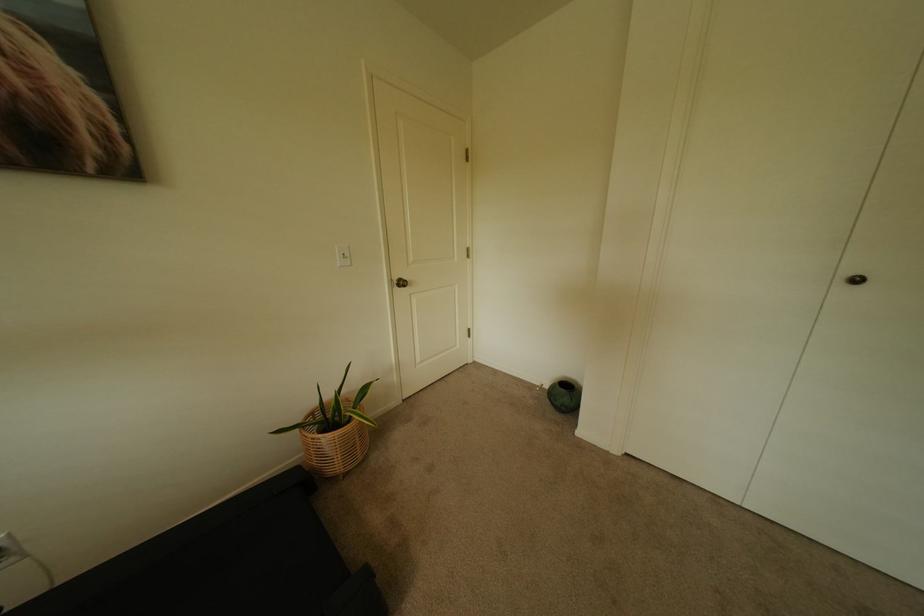
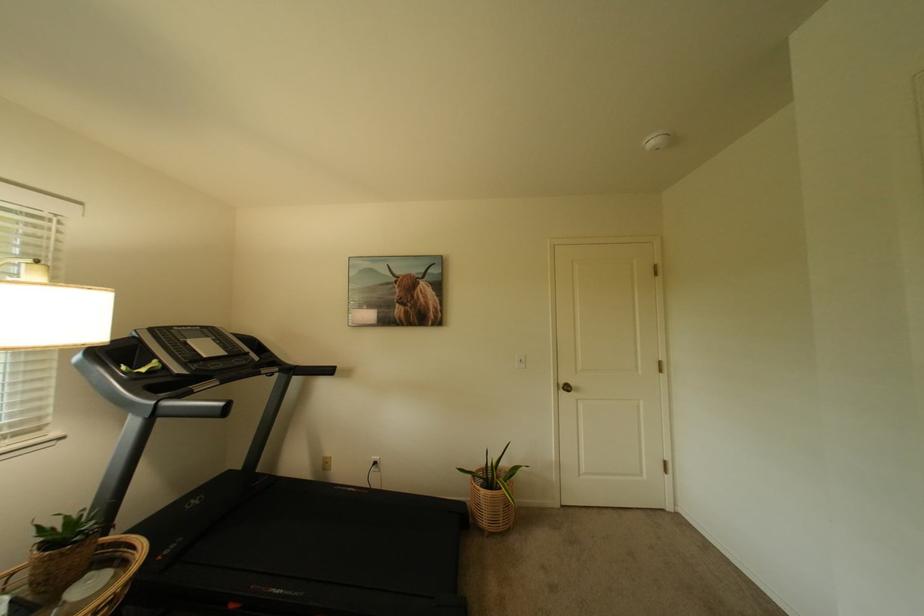
Locate, in the second image, the point that corresponds to the point at 404,282 in the first image.

(569, 386)